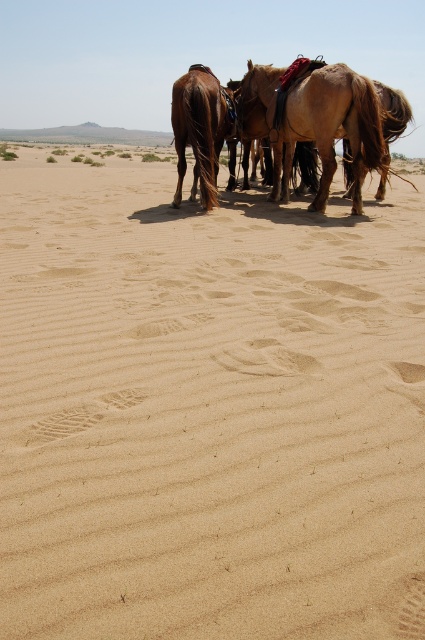
You are a rider who needs to tie your horse to a post that is 1.5 meters away from another horse. You have two horses here, a brown textured horse at center and a brown glossy horse at center. Can you tie your horse to the post without the horses getting too close to each other?

The distance between the brown textured horse at center and the brown glossy horse at center is 1.32 meters. Since the post is 1.5 meters away from another horse, tying your horse there would result in a distance of 1.5 meters between them, which is greater than their current 1.32 meters. This means the horses would be slightly farther apart than they are now, so they would not be too close to each other.

You are a rider who wants to choose a horse to ride across the desert. You need a taller horse to see over the dunes. Which horse should you choose between the brown textured horse at center and the brown glossy horse at center?

The brown textured horse at center is taller than the brown glossy horse at center, so you should choose the brown textured horse at center to ride across the desert for better visibility over the dunes.

You are a photographer trying to capture the two horses in the desert scene. You notice that the brown textured horse at center and the brown glossy horse at center are overlapping. Which horse is partially hiding the other one?

The brown textured horse at center is positioned over brown glossy horse at center, so it is partially hiding the glossy horse.